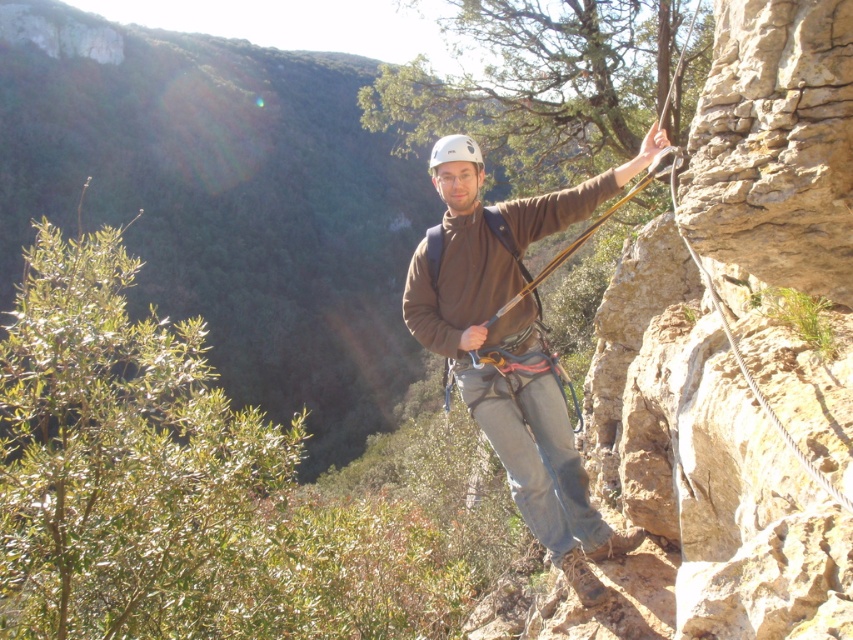
Which of these two, brown fabric jacket at center or white matte helmet at center, stands shorter?

With less height is brown fabric jacket at center.

Can you confirm if brown fabric jacket at center is smaller than white matte helmet at center?

Correct, brown fabric jacket at center occupies less space than white matte helmet at center.

Which is in front, point (434, 348) or point (473, 156)?

Positioned in front is point (473, 156).

The height and width of the screenshot is (640, 853). What are the coordinates of `brown fabric jacket at center` in the screenshot? It's located at (509, 392).